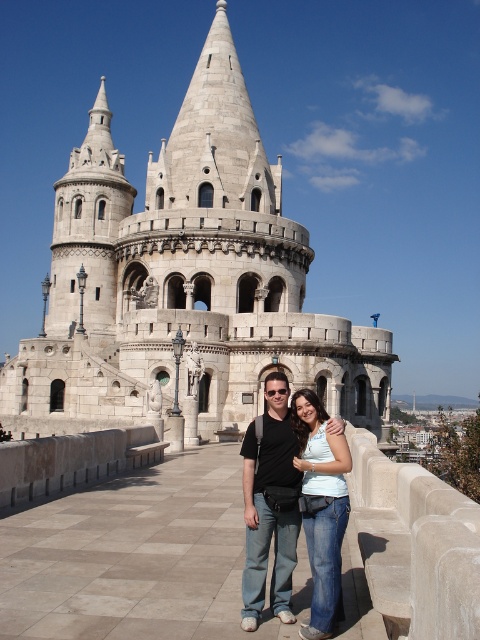
Between point (276, 563) and point (314, 401), which one is positioned in front?

Point (276, 563) is in front.

Is matte black shirt at center above denim jeans at center?

Indeed, matte black shirt at center is positioned over denim jeans at center.

Describe the element at coordinates (269, 506) in the screenshot. This screenshot has width=480, height=640. I see `matte black shirt at center` at that location.

Locate an element on the screen. The image size is (480, 640). matte black shirt at center is located at coordinates (269, 506).

Which is above, white stone fort at center or denim jeans at center?

white stone fort at center is above.

Is point (346, 348) behind point (310, 515)?

Yes, it is.

Locate an element on the screen. white stone fort at center is located at coordinates (187, 276).

Where is `white stone fort at center`? Image resolution: width=480 pixels, height=640 pixels. white stone fort at center is located at coordinates (187, 276).

Can you confirm if white stone fort at center is positioned above matte black shirt at center?

Indeed, white stone fort at center is positioned over matte black shirt at center.

What are the coordinates of `white stone fort at center` in the screenshot? It's located at (187, 276).

This screenshot has height=640, width=480. Find the location of `white stone fort at center`. white stone fort at center is located at coordinates (187, 276).